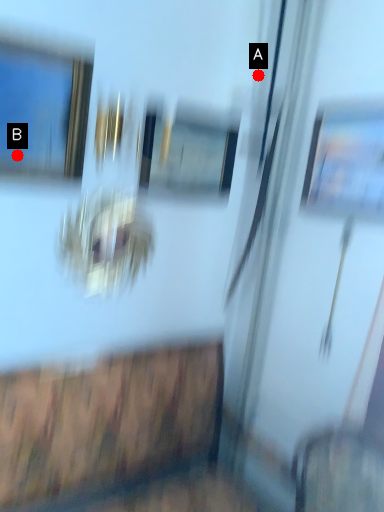
Question: Two points are circled on the image, labeled by A and B beside each circle. Which point appears farthest from the camera in this image?

Choices:
 (A) A is further
 (B) B is further

Answer: (A)